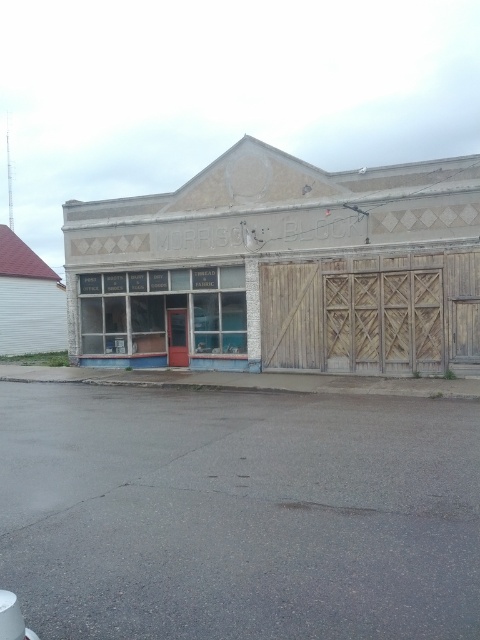
Does wooden at right come behind red wood door at center?

No, it is in front of red wood door at center.

Can you confirm if wooden at right is positioned to the left of red wood door at center?

No, wooden at right is not to the left of red wood door at center.

The width and height of the screenshot is (480, 640). What are the coordinates of `wooden at right` in the screenshot? It's located at (372, 314).

Looking at this image, between white painted wood storefront at center and red wood door at center, which one has less height?

With less height is red wood door at center.

Is white painted wood storefront at center positioned behind red wood door at center?

No, it is in front of red wood door at center.

This screenshot has height=640, width=480. I want to click on white painted wood storefront at center, so click(x=283, y=268).

Can you confirm if white painted wood storefront at center is taller than wooden at right?

Yes.

Is point (477, 216) positioned behind point (405, 282)?

No, (477, 216) is closer to viewer.

Does point (137, 244) come in front of point (348, 369)?

That is False.

Identify the location of white painted wood storefront at center. (283, 268).